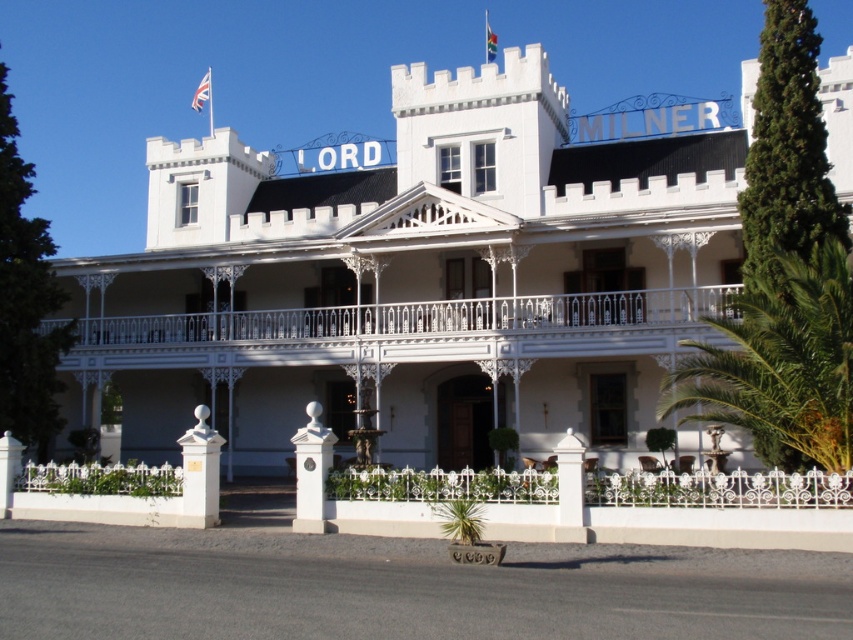
Measure the distance between point (x=576, y=333) and camera.

Point (x=576, y=333) is 49.95 meters from camera.

Measure the distance between white wrought iron fence at center and camera.

A distance of 40.08 meters exists between white wrought iron fence at center and camera.

Is point (80, 408) more distant than point (781, 312)?

Yes, it is behind point (781, 312).

Locate an element on the screen. This screenshot has height=640, width=853. white wrought iron fence at center is located at coordinates (416, 278).